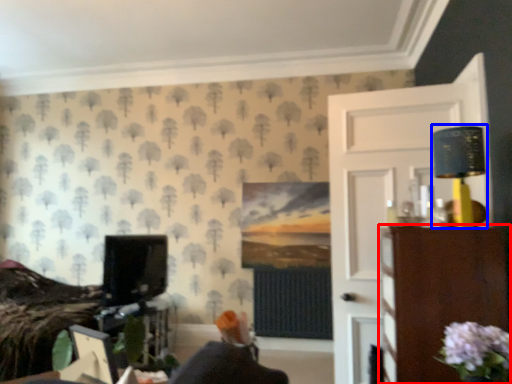
Question: Which point is further to the camera, furniture (highlighted by a red box) or table lamp (highlighted by a blue box)?

Choices:
 (A) furniture
 (B) table lamp

Answer: (B)